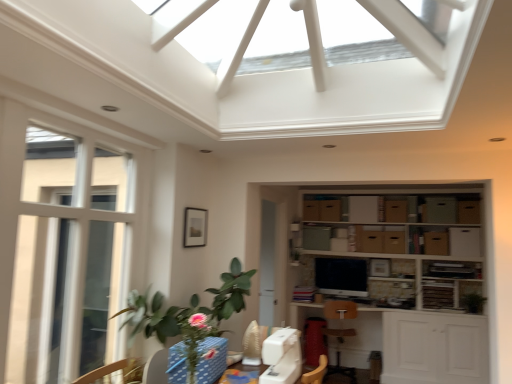
Question: Does clear glass window at left appear on the left side of blue polka dot fabric at lower center?

Choices:
 (A) yes
 (B) no

Answer: (A)

Question: Is clear glass window at left far from blue polka dot fabric at lower center?

Choices:
 (A) no
 (B) yes

Answer: (A)

Question: Is clear glass window at left outside blue polka dot fabric at lower center?

Choices:
 (A) yes
 (B) no

Answer: (A)

Question: Is clear glass window at left turned away from blue polka dot fabric at lower center?

Choices:
 (A) no
 (B) yes

Answer: (A)

Question: Is clear glass window at left positioned in front of blue polka dot fabric at lower center?

Choices:
 (A) yes
 (B) no

Answer: (A)

Question: Does clear glass window at left have a greater height compared to blue polka dot fabric at lower center?

Choices:
 (A) no
 (B) yes

Answer: (B)

Question: From a real-world perspective, is wooden shelves at center on green leafy plant at right?

Choices:
 (A) yes
 (B) no

Answer: (A)

Question: Is wooden shelves at center at the left side of green leafy plant at right?

Choices:
 (A) no
 (B) yes

Answer: (B)

Question: From the image's perspective, is wooden shelves at center beneath green leafy plant at right?

Choices:
 (A) no
 (B) yes

Answer: (A)

Question: From a real-world perspective, does wooden shelves at center sit lower than green leafy plant at right?

Choices:
 (A) no
 (B) yes

Answer: (A)

Question: Is there a large distance between wooden shelves at center and green leafy plant at right?

Choices:
 (A) no
 (B) yes

Answer: (A)

Question: From the image's perspective, is wooden shelves at center on top of green leafy plant at right?

Choices:
 (A) yes
 (B) no

Answer: (A)

Question: Is wooden shelves at center facing away from white glossy exhaust hood at upper center?

Choices:
 (A) yes
 (B) no

Answer: (B)